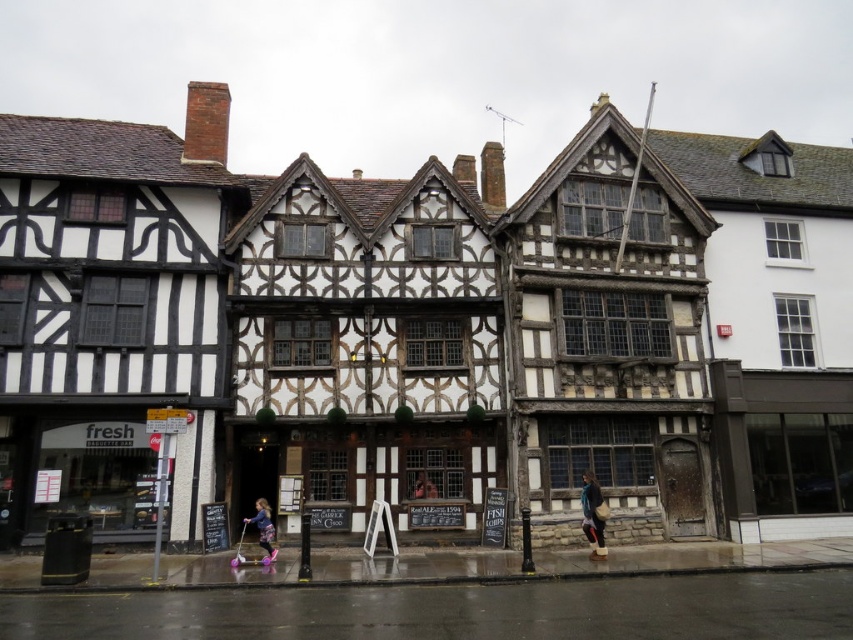
Question: Among these points, which one is farthest from the camera?

Choices:
 (A) (270, 518)
 (B) (595, 520)

Answer: (A)

Question: Does blue denim jacket at center appear over pink fabric pants at lower center?

Choices:
 (A) yes
 (B) no

Answer: (A)

Question: Which point appears farthest from the camera in this image?

Choices:
 (A) (265, 545)
 (B) (602, 540)

Answer: (B)

Question: Can you confirm if blue denim jacket at center is positioned to the left of pink fabric pants at lower center?

Choices:
 (A) yes
 (B) no

Answer: (B)

Question: Where is blue denim jacket at center located in relation to pink fabric pants at lower center in the image?

Choices:
 (A) left
 (B) right

Answer: (B)